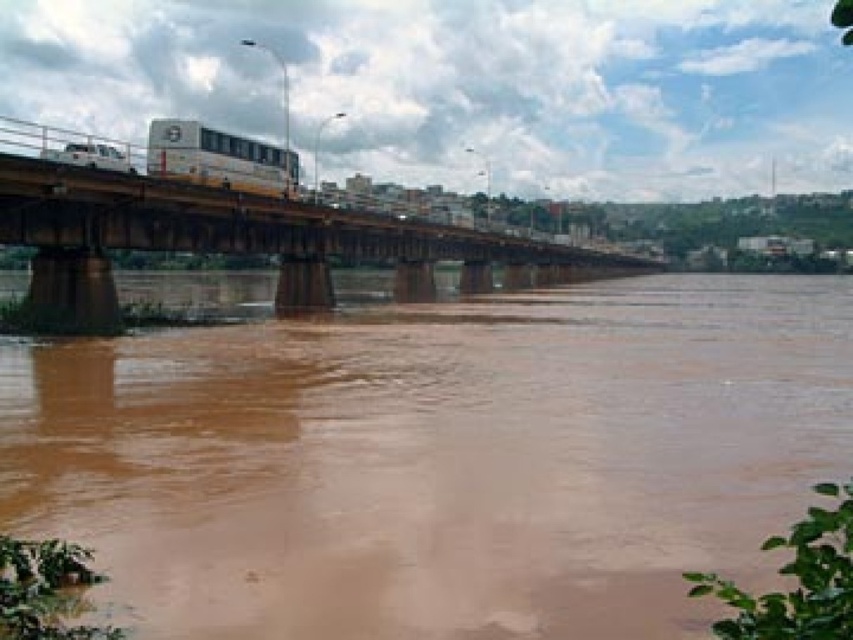
Question: Observing the image, what is the correct spatial positioning of brown metallic bridge at center in reference to yellow metallic bus at center?

Choices:
 (A) below
 (B) above

Answer: (A)

Question: Among these points, which one is nearest to the camera?

Choices:
 (A) (430, 508)
 (B) (216, 252)
 (C) (256, 163)

Answer: (A)

Question: Among these objects, which one is farthest from the camera?

Choices:
 (A) yellow metallic bus at center
 (B) brown muddy water at center

Answer: (A)

Question: Does brown muddy water at center appear under yellow metallic bus at center?

Choices:
 (A) yes
 (B) no

Answer: (A)

Question: Which of the following is the closest to the observer?

Choices:
 (A) yellow metallic bus at center
 (B) brown metallic bridge at center

Answer: (B)

Question: In this image, where is brown muddy water at center located relative to brown metallic bridge at center?

Choices:
 (A) below
 (B) above

Answer: (A)